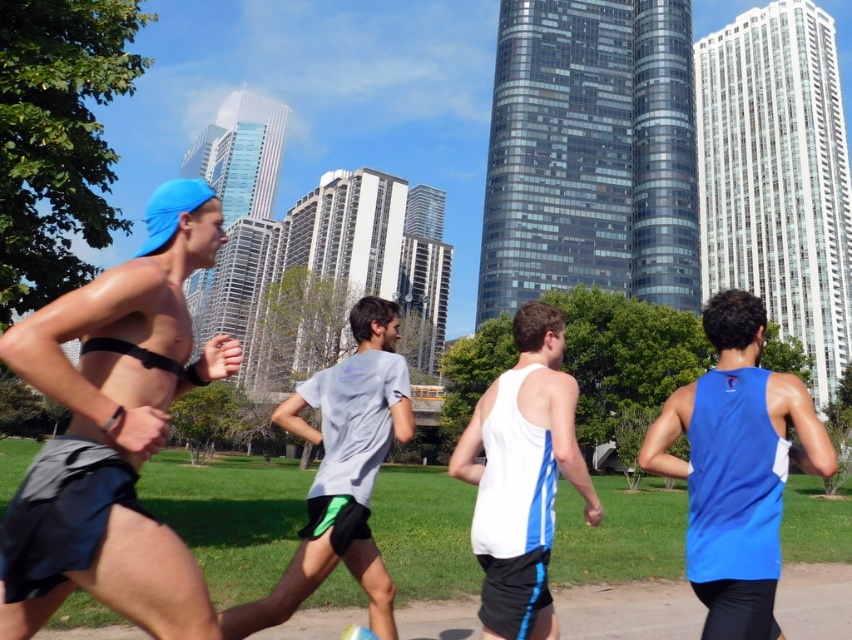
Question: Is blue fabric tank top at right behind white matte tank top at center?

Choices:
 (A) no
 (B) yes

Answer: (A)

Question: Which point is closer to the camera taking this photo?

Choices:
 (A) (504, 593)
 (B) (70, 426)

Answer: (B)

Question: Does white matte tank top at center have a smaller size compared to gray fabric shirt at center?

Choices:
 (A) yes
 (B) no

Answer: (A)

Question: Is matte blue cap at left below blue fabric tank top at right?

Choices:
 (A) no
 (B) yes

Answer: (A)

Question: Which point is farther to the camera?

Choices:
 (A) (758, 404)
 (B) (154, 442)

Answer: (A)

Question: Which object appears closest to the camera in this image?

Choices:
 (A) matte blue cap at left
 (B) blue fabric tank top at right
 (C) gray fabric shirt at center

Answer: (A)